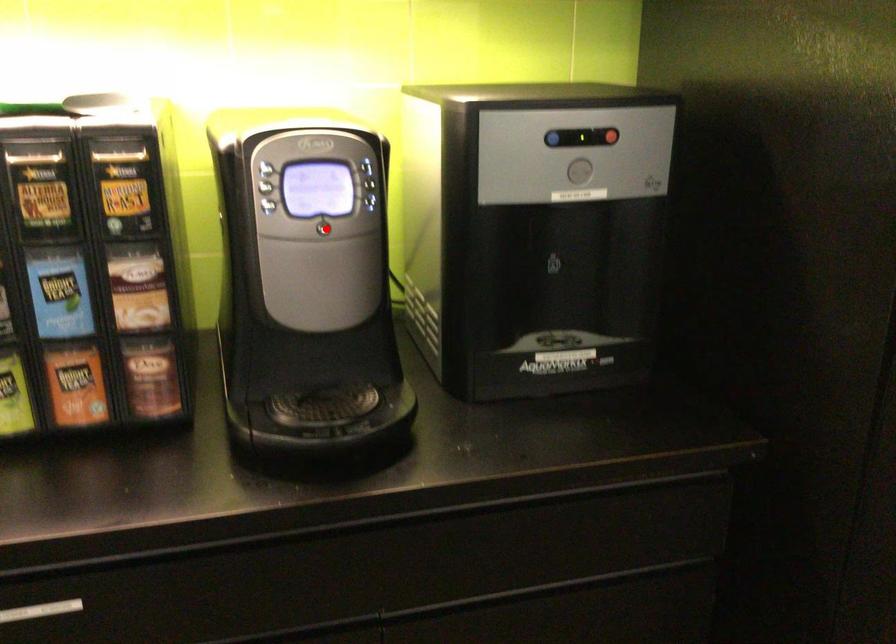
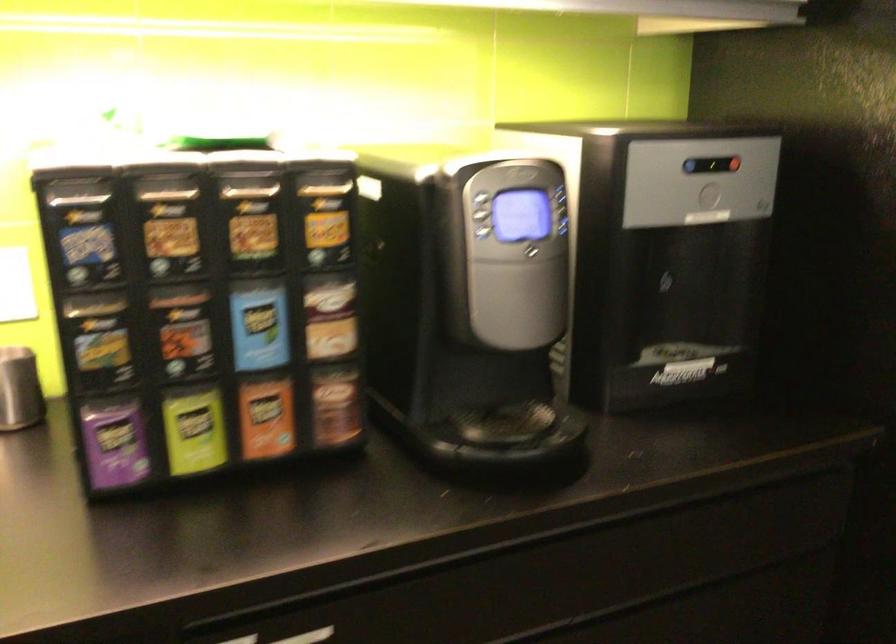
In the second image, find the point that corresponds to the highlighted location in the first image.

(533, 252)